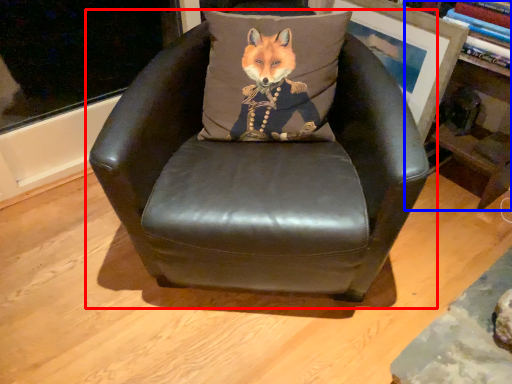
Question: Which object is further to the camera taking this photo, chair (highlighted by a red box) or bookshelf (highlighted by a blue box)?

Choices:
 (A) chair
 (B) bookshelf

Answer: (B)